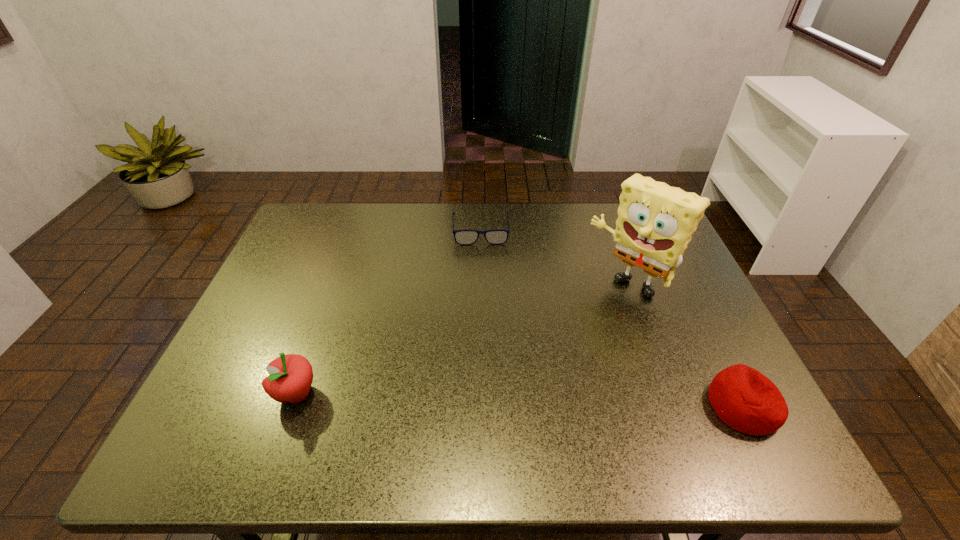
Locate an element on the screen. sponge that is at the right edge is located at coordinates 655,222.

Identify the location of object located in the near left corner section of the desktop. This screenshot has height=540, width=960. (290, 377).

Where is `object that is at the near right corner`? The image size is (960, 540). object that is at the near right corner is located at coordinates (746, 400).

In order to click on vacant space at the far edge of the desktop in this screenshot , I will do `click(360, 227)`.

Identify the location of vacant space at the near edge of the desktop. This screenshot has width=960, height=540. (384, 413).

Identify the location of vacant space at the left edge. Image resolution: width=960 pixels, height=540 pixels. (314, 310).

This screenshot has width=960, height=540. What are the coordinates of `free space at the right edge` in the screenshot? It's located at pos(647,310).

I want to click on free location at the far left corner of the desktop, so click(311, 212).

Locate an element on the screen. The image size is (960, 540). empty location between the leftmost object and the beanbag is located at coordinates (520, 400).

Locate an element on the screen. The height and width of the screenshot is (540, 960). free spot between the third object from right to left and the third tallest object is located at coordinates (612, 318).